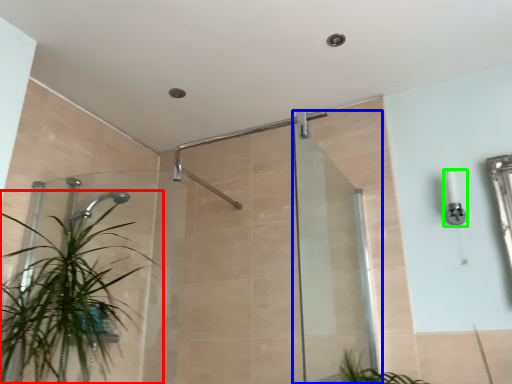
Question: Estimate the real-world distances between objects in this image. Which object is farther from houseplant (highlighted by a red box), screen door (highlighted by a blue box) or light fixture (highlighted by a green box)?

Choices:
 (A) screen door
 (B) light fixture

Answer: (B)